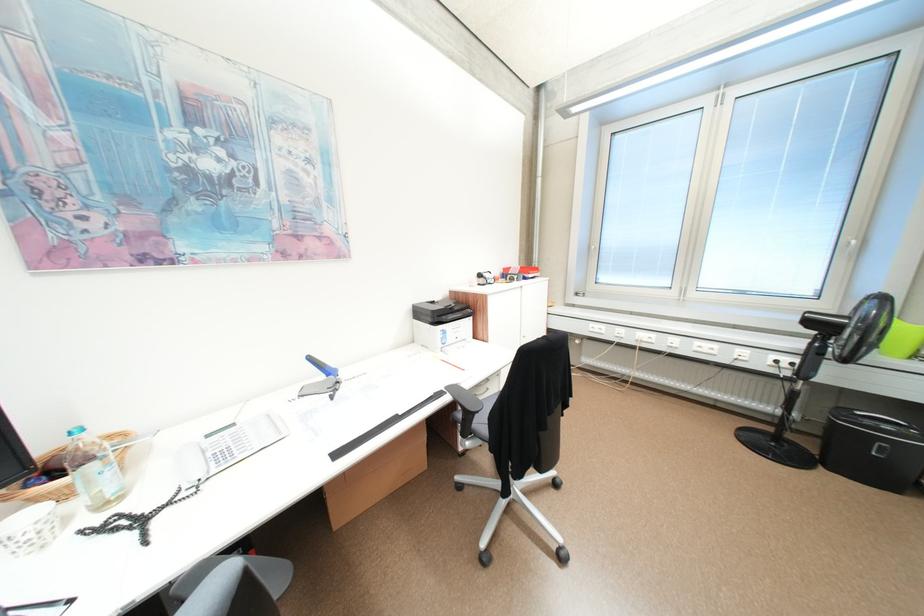
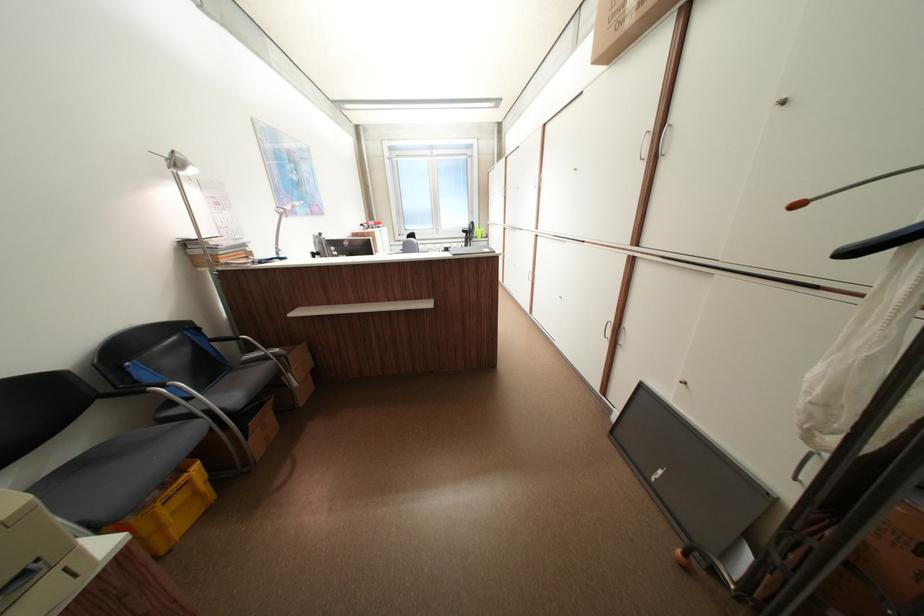
In the second image, find the point that corresponds to point 487,411 in the first image.

(409, 254)